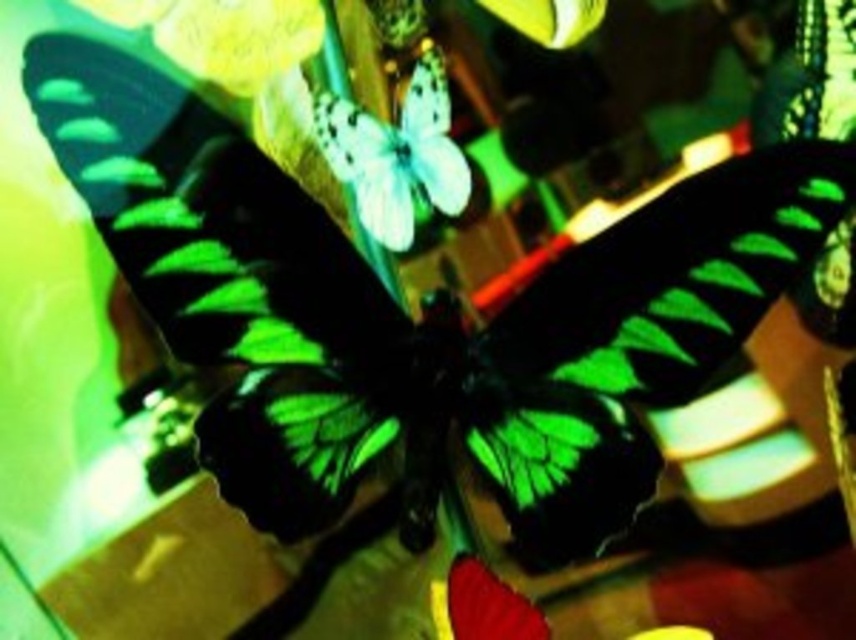
Question: Can you confirm if white matte butterfly at center is smaller than matte yellow flower at upper left?

Choices:
 (A) no
 (B) yes

Answer: (A)

Question: Does matte yellow flower at upper left appear on the left side of transparent glass vase at lower right?

Choices:
 (A) yes
 (B) no

Answer: (A)

Question: Which of the following is the farthest from the observer?

Choices:
 (A) white matte butterfly at center
 (B) matte yellow flower at upper left
 (C) transparent glass vase at lower right

Answer: (C)

Question: Is white matte butterfly at center positioned before transparent glass vase at lower right?

Choices:
 (A) no
 (B) yes

Answer: (B)

Question: Which point is closer to the camera?

Choices:
 (A) white matte butterfly at center
 (B) transparent glass vase at lower right

Answer: (A)

Question: Which is farther from the matte yellow flower at upper left?

Choices:
 (A) white matte butterfly at center
 (B) transparent glass vase at lower right

Answer: (B)